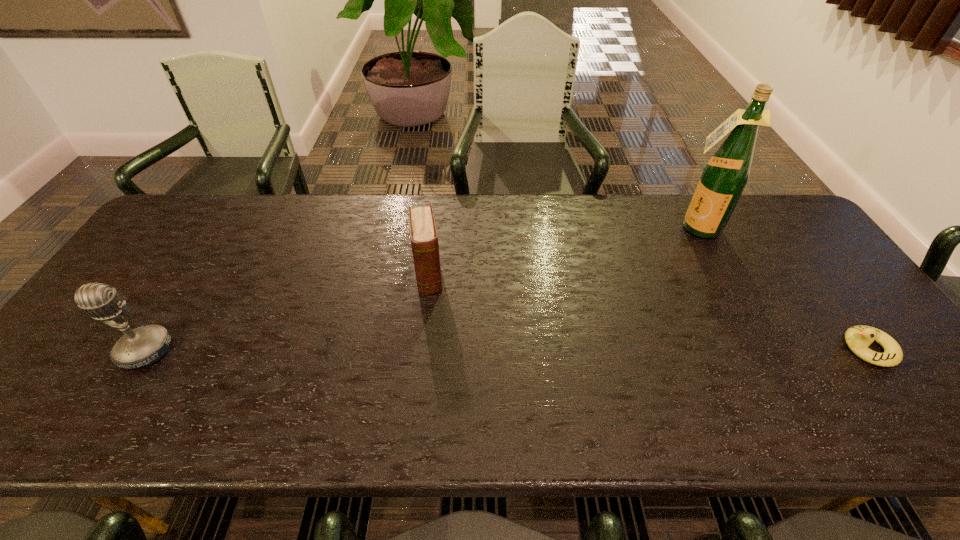
The width and height of the screenshot is (960, 540). In order to click on unoccupied position between the liquor and the shortest object in this screenshot , I will do `click(781, 288)`.

Where is `free space between the third object from left to right and the rightmost object`? free space between the third object from left to right and the rightmost object is located at coordinates (781, 288).

This screenshot has height=540, width=960. Identify the location of free spot between the rightmost object and the microphone. (507, 350).

You are a GUI agent. You are given a task and a screenshot of the screen. Output one action in this format:
    pyautogui.click(x=<x>, y=<y>)
    Task: Click on the vacant area that lies between the duckling and the second shortest object
    
    Given the screenshot: What is the action you would take?
    pyautogui.click(x=648, y=312)

This screenshot has width=960, height=540. I want to click on vacant area that lies between the second tallest object and the diary, so click(x=287, y=313).

Locate an element on the screen. This screenshot has height=540, width=960. empty space that is in between the second object from left to right and the shortest object is located at coordinates (648, 312).

Find the location of `free spot between the second tallest object and the duckling`. free spot between the second tallest object and the duckling is located at coordinates (507, 350).

Find the location of a particular element. The image size is (960, 540). free space between the leftmost object and the third tallest object is located at coordinates (287, 313).

Identify the location of vacant space in between the shortest object and the second shortest object. (648, 312).

The width and height of the screenshot is (960, 540). I want to click on object that can be found as the closest to the duckling, so click(725, 176).